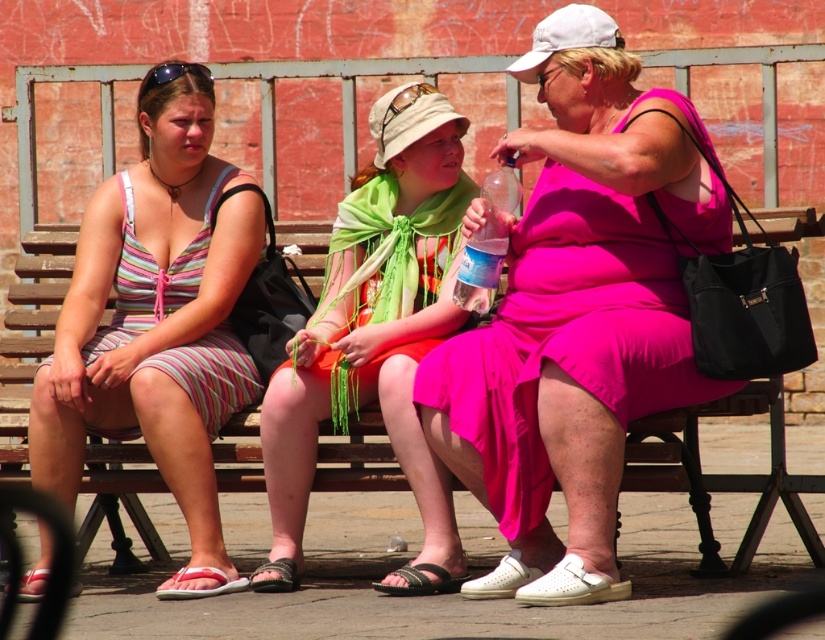
Question: Is pink matte dress at center to the right of matte green scarf at center from the viewer's perspective?

Choices:
 (A) yes
 (B) no

Answer: (A)

Question: Among these points, which one is farthest from the camera?

Choices:
 (A) 118,468
 (B) 398,112
 (C) 288,474

Answer: (A)

Question: Among these objects, which one is nearest to the camera?

Choices:
 (A) wooden bench at center
 (B) matte brown goggles at center
 (C) matte green scarf at center
 (D) striped cotton dress at left

Answer: (A)

Question: Is clear plastic bottle at center further to the viewer compared to matte brown goggles at center?

Choices:
 (A) no
 (B) yes

Answer: (A)

Question: Is pink matte dress at center further to the viewer compared to wooden bench at center?

Choices:
 (A) yes
 (B) no

Answer: (A)

Question: Which point is farther to the camera?

Choices:
 (A) wooden bench at center
 (B) matte brown goggles at center
 (C) clear plastic bottle at center

Answer: (B)